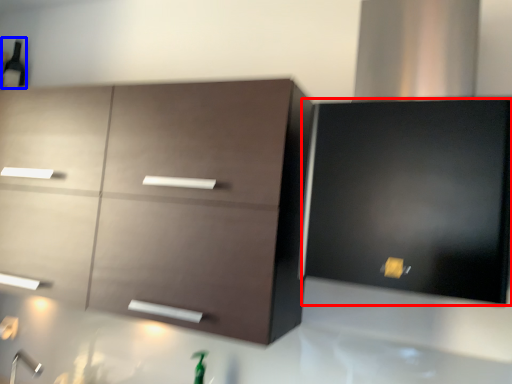
Question: Among these objects, which one is nearest to the camera, cabinetry (highlighted by a red box) or beer bottle (highlighted by a blue box)?

Choices:
 (A) cabinetry
 (B) beer bottle

Answer: (A)